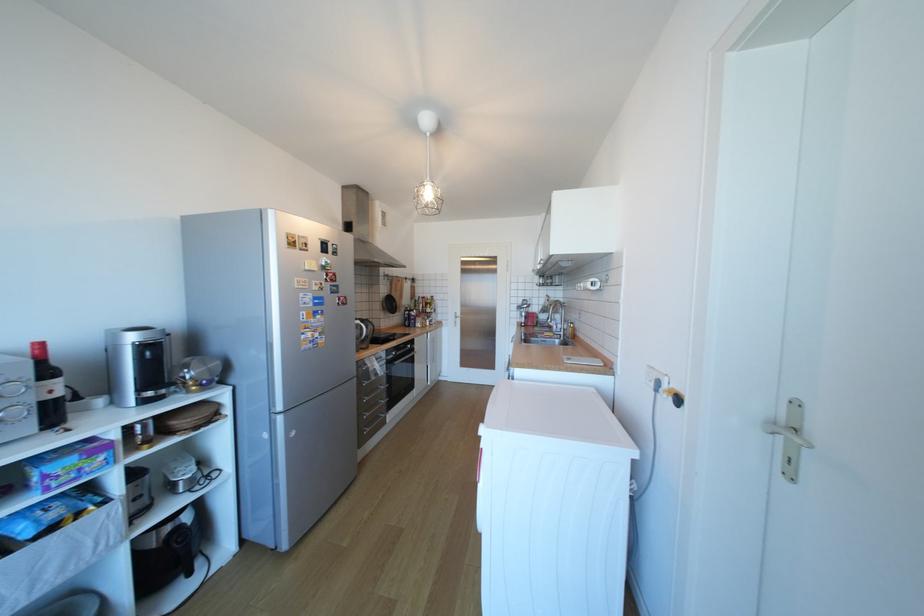
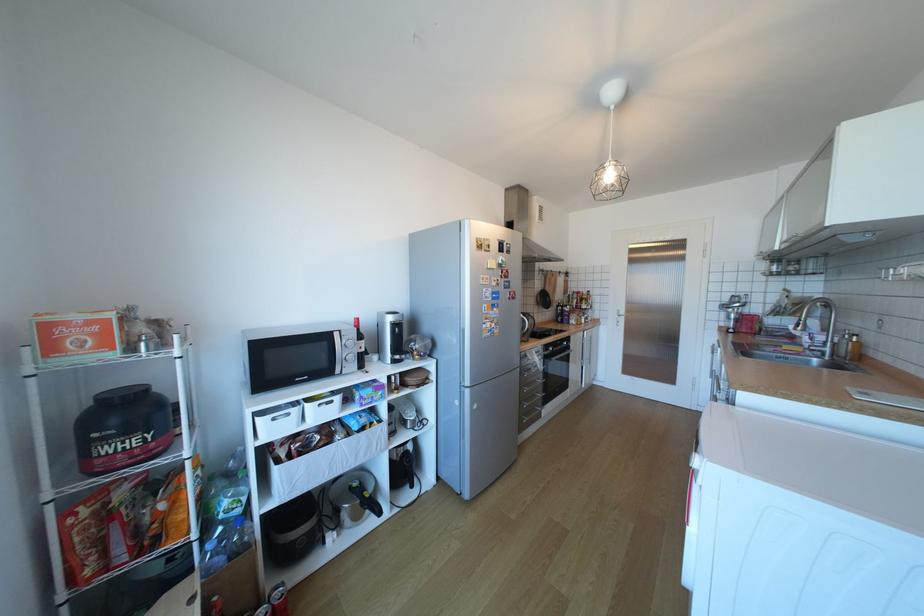
The point at (369, 416) is marked in the first image. Where is the corresponding point in the second image?

(529, 403)